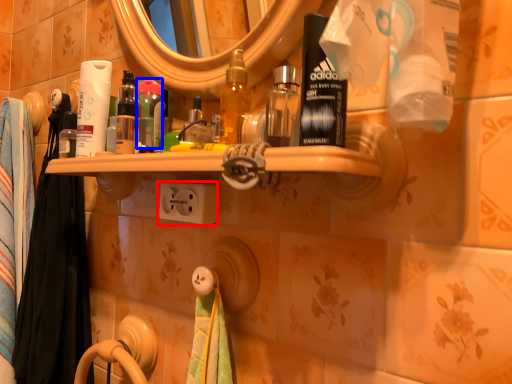
Question: Which of the following is the closest to the observer, electric outlet (highlighted by a red box) or mouthwash (highlighted by a blue box)?

Choices:
 (A) electric outlet
 (B) mouthwash

Answer: (A)